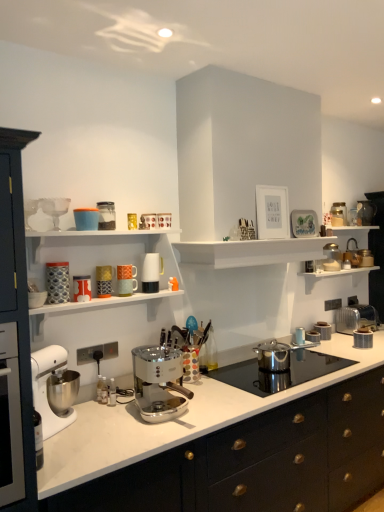
Question: Would you say matte ceramic mug at upper center, positioned as the 6th kitchen appliance in front-to-back order, is part of metallic silver toaster at center, the first appliance in the bottom-to-top sequence,'s contents?

Choices:
 (A) yes
 (B) no

Answer: (B)

Question: Can you confirm if metallic silver toaster at center, the first appliance in the bottom-to-top sequence, is wider than matte ceramic mug at upper center, the sixth kitchen appliance viewed from the right?

Choices:
 (A) no
 (B) yes

Answer: (A)

Question: From a real-world perspective, is metallic silver toaster at center, the fifth appliance from the right, over matte ceramic mug at upper center, which is the 7th kitchen appliance in back-to-front order?

Choices:
 (A) no
 (B) yes

Answer: (A)

Question: Is metallic silver toaster at center, the eighth appliance in the top-to-bottom sequence, to the right of matte ceramic mug at upper center, the 7th kitchen appliance viewed from the left, from the viewer's perspective?

Choices:
 (A) yes
 (B) no

Answer: (A)

Question: Can we say metallic silver toaster at center, which ranks as the 5th appliance in back-to-front order, lies outside matte ceramic mug at upper center, which is the 7th kitchen appliance in back-to-front order?

Choices:
 (A) no
 (B) yes

Answer: (B)

Question: Is metallic silver toaster at center, the fourth appliance from the left, shorter than matte ceramic mug at upper center, which is the 7th kitchen appliance in back-to-front order?

Choices:
 (A) yes
 (B) no

Answer: (A)

Question: From a real-world perspective, is metallic silver kettle at upper right, arranged as the 3th appliance when viewed from the right, on top of translucent glass jar at upper right, which ranks as the first appliance in right-to-left order?

Choices:
 (A) no
 (B) yes

Answer: (A)

Question: Is metallic silver kettle at upper right, arranged as the 3th appliance when viewed from the right, wider than translucent glass jar at upper right, which ranks as the first appliance in right-to-left order?

Choices:
 (A) yes
 (B) no

Answer: (B)

Question: Does metallic silver kettle at upper right, the third appliance viewed from the back, have a larger size compared to translucent glass jar at upper right, the first appliance viewed from the top?

Choices:
 (A) yes
 (B) no

Answer: (B)

Question: From a real-world perspective, is metallic silver kettle at upper right, arranged as the 3th appliance when viewed from the right, beneath translucent glass jar at upper right, the first appliance viewed from the top?

Choices:
 (A) yes
 (B) no

Answer: (A)

Question: Considering the relative positions of metallic silver kettle at upper right, arranged as the 3th appliance when viewed from the right, and translucent glass jar at upper right, the first appliance viewed from the top, in the image provided, is metallic silver kettle at upper right, arranged as the 3th appliance when viewed from the right, behind translucent glass jar at upper right, the first appliance viewed from the top,?

Choices:
 (A) no
 (B) yes

Answer: (A)

Question: Is metallic silver kettle at upper right, the third appliance viewed from the back, outside translucent glass jar at upper right, which ranks as the 7th appliance in front-to-back order?

Choices:
 (A) no
 (B) yes

Answer: (B)

Question: Are metallic silver kettle at upper right, which ranks as the 5th appliance in bottom-to-top order, and metallic silver toaster at upper right, the fifth appliance viewed from the top, beside each other?

Choices:
 (A) yes
 (B) no

Answer: (B)